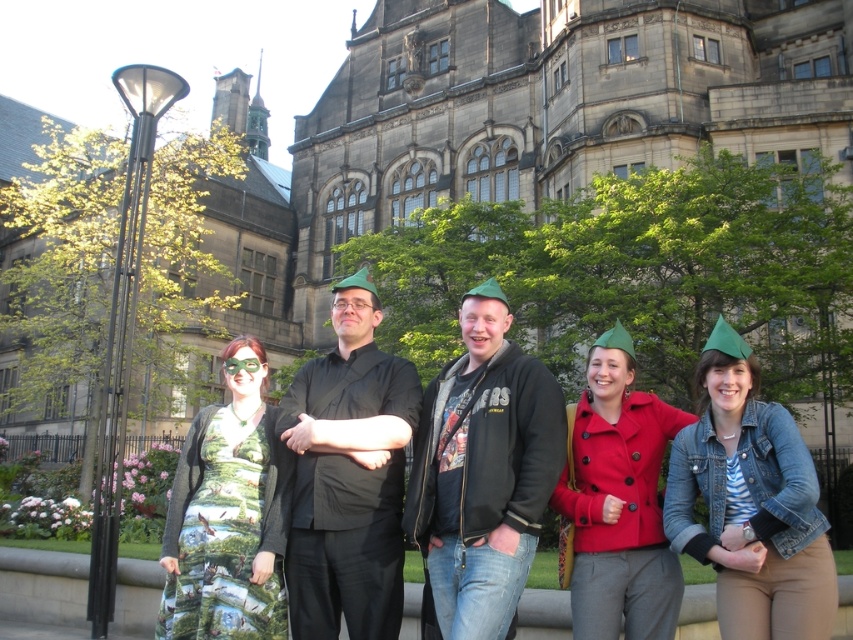
Does point (549, 440) come in front of point (701, 483)?

Yes, it is.

What do you see at coordinates (482, 472) in the screenshot? The width and height of the screenshot is (853, 640). I see `matte black jacket at center` at bounding box center [482, 472].

Locate an element on the screen. matte black jacket at center is located at coordinates (482, 472).

Is black matte shirt at center positioned before matte green hat at center?

No.

Is point (357, 520) positioned in front of point (590, 586)?

No, (357, 520) is further to viewer.

Looking at this image, who is more forward, (294,611) or (630,621)?

Positioned in front is point (630,621).

I want to click on black matte shirt at center, so click(347, 476).

Who is higher up, printed fabric dress at center or matte green hat at center?

Positioned higher is matte green hat at center.

Does printed fabric dress at center have a smaller size compared to matte green hat at center?

Yes.

Is point (293, 468) less distant than point (624, 406)?

Yes, point (293, 468) is closer to viewer.

This screenshot has height=640, width=853. Find the location of `printed fabric dress at center`. printed fabric dress at center is located at coordinates (228, 515).